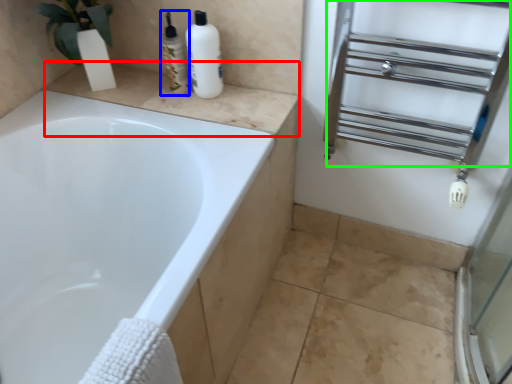
Question: Estimate the real-world distances between objects in this image. Which object is farther from counter top (highlighted by a red box), toiletry (highlighted by a blue box) or shelf (highlighted by a green box)?

Choices:
 (A) toiletry
 (B) shelf

Answer: (B)